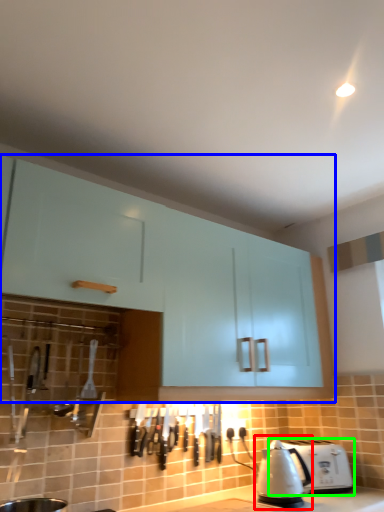
Question: Which object is the closest to the kettle (highlighted by a red box)? Choose among these: cabinetry (highlighted by a blue box) or toaster (highlighted by a green box).

Choices:
 (A) cabinetry
 (B) toaster

Answer: (B)